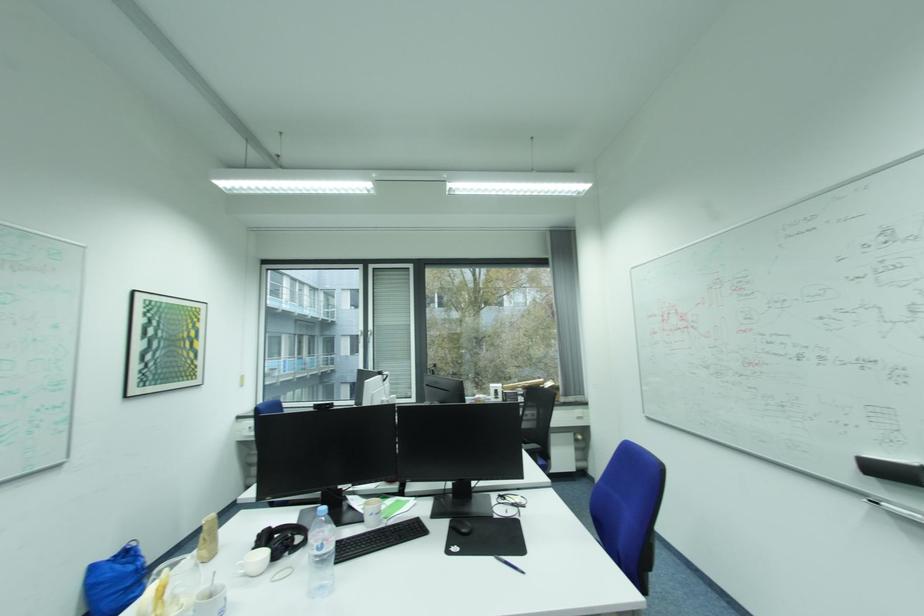
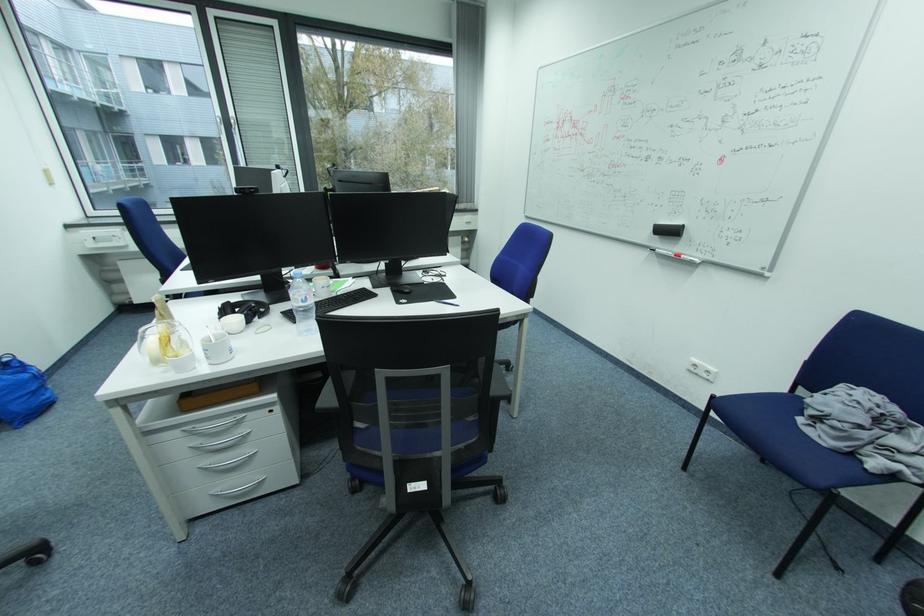
Where in the second image is the point corresponding to the point at 323,549 from the first image?

(310, 301)